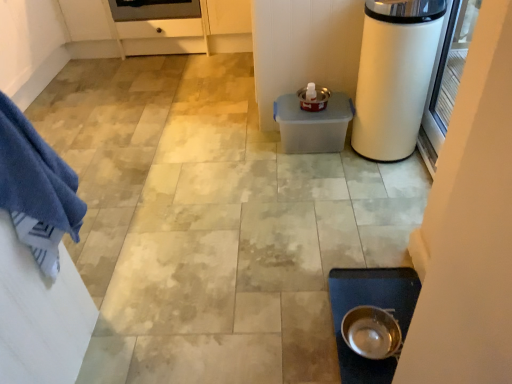
Question: Is blue cotton towel at left bigger or smaller than metallic silver bowl at lower center?

Choices:
 (A) big
 (B) small

Answer: (A)

Question: Considering their positions, is blue cotton towel at left located in front of or behind metallic silver bowl at lower center?

Choices:
 (A) front
 (B) behind

Answer: (A)

Question: Which object is positioned closest to the metallic silver bowl at lower center?

Choices:
 (A) white glossy trash can at right
 (B) blue cotton towel at left
 (C) transparent glass screen door at right

Answer: (A)

Question: Based on their relative distances, which object is farther from the blue cotton towel at left?

Choices:
 (A) transparent glass screen door at right
 (B) white glossy trash can at right
 (C) metallic silver bowl at lower center

Answer: (A)